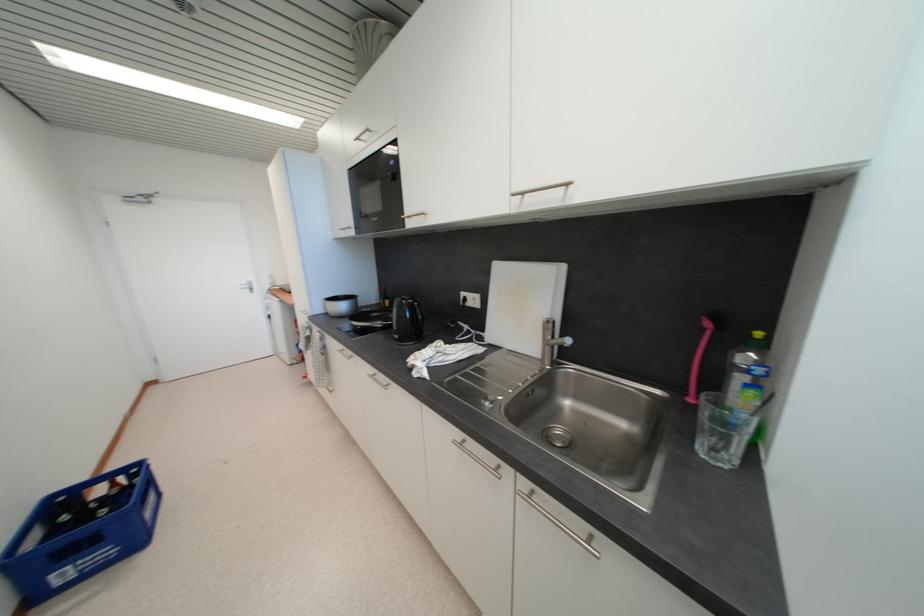
This screenshot has height=616, width=924. In order to click on black pan handle in this screenshot , I will do `click(371, 320)`.